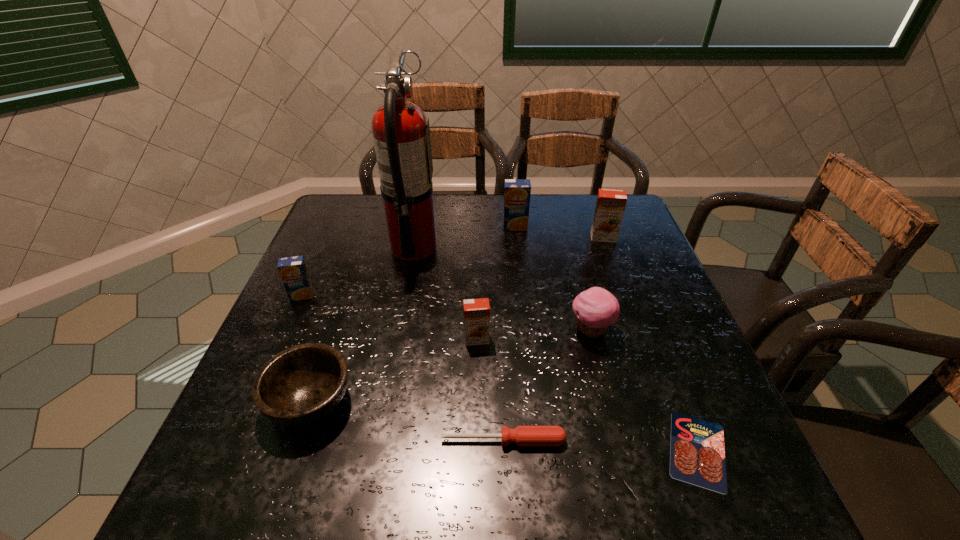
You are a GUI agent. You are given a task and a screenshot of the screen. Output one action in this format:
    pyautogui.click(x=<x>, y=<y>)
    Task: Click on the tallest object
    This screenshot has width=960, height=540.
    Given the screenshot: What is the action you would take?
    [x=401, y=133]

At what (x,y) coordinates should I click in order to perform the action: click on red fire extinguisher. Please return your answer as a coordinate pair (x, y). Looking at the image, I should click on (401, 133).

Where is `the right orange orange juice`? the right orange orange juice is located at coordinates (610, 206).

Image resolution: width=960 pixels, height=540 pixels. What are the coordinates of `the rightmost orange juice` in the screenshot? It's located at (610, 206).

Identify the location of the farthest orange juice. (517, 192).

Locate an element on the screen. Image resolution: width=960 pixels, height=540 pixels. the right blue orange_juice is located at coordinates (517, 192).

The width and height of the screenshot is (960, 540). In order to click on the seventh object from left to right in this screenshot , I will do `click(596, 309)`.

At what (x,y) coordinates should I click in order to perform the action: click on cupcake. Please return your answer as a coordinate pair (x, y). Image resolution: width=960 pixels, height=540 pixels. Looking at the image, I should click on (596, 309).

In order to click on the second nearest orange juice in this screenshot , I will do `click(293, 271)`.

Locate an element on the screen. the smaller blue orange_juice is located at coordinates (293, 271).